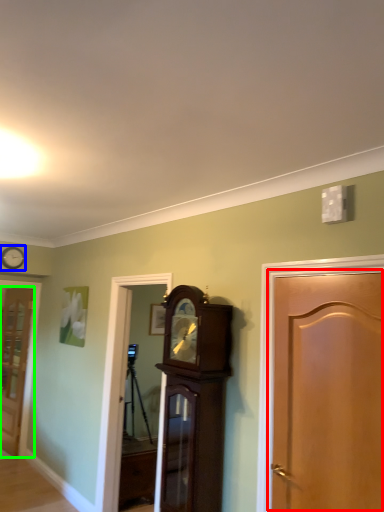
Question: Which object is positioned closest to door (highlighted by a red box)? Select from clock (highlighted by a blue box) and door (highlighted by a green box).

Choices:
 (A) clock
 (B) door

Answer: (A)